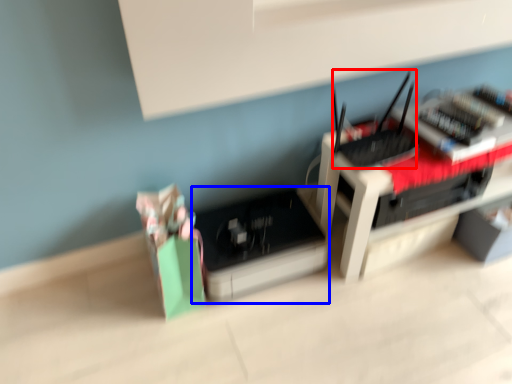
Question: Which object is closer to the camera taking this photo, register (highlighted by a red box) or register (highlighted by a blue box)?

Choices:
 (A) register
 (B) register

Answer: (A)